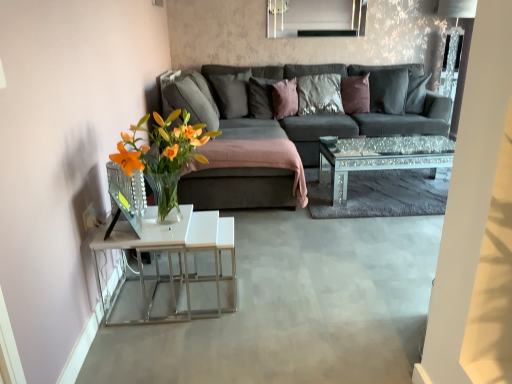
Question: Is purple velvet pillow at center, which is the third pillow from left to right, taller or shorter than satin brown pillow at center, the fourth pillow positioned from the right?

Choices:
 (A) short
 (B) tall

Answer: (A)

Question: Is purple velvet pillow at center, which is counted as the third pillow, starting from the right, in front of or behind satin brown pillow at center, the fourth pillow positioned from the right, in the image?

Choices:
 (A) behind
 (B) front

Answer: (B)

Question: Which object is the closest to the dark gray fabric couch at center?

Choices:
 (A) purple velvet pillow at center, which is counted as the third pillow, starting from the right
 (B) velvet brown pillow at center, the second pillow when ordered from right to left
 (C) matte gray pillow at center, the fifth pillow from the right
 (D) dark gray fabric pillow at center, which is counted as the 1th pillow, starting from the right
 (E) satin brown pillow at center, marked as the second pillow in a left-to-right arrangement

Answer: (D)

Question: Which of these objects is positioned farthest from the velvet brown pillow at center, which is the 4th pillow in left-to-right order?

Choices:
 (A) matte gray pillow at center, the fifth pillow from the right
 (B) satin brown pillow at center, marked as the second pillow in a left-to-right arrangement
 (C) purple velvet pillow at center, which is counted as the third pillow, starting from the right
 (D) dark gray fabric pillow at center, which is counted as the 1th pillow, starting from the right
 (E) dark gray fabric couch at center

Answer: (A)